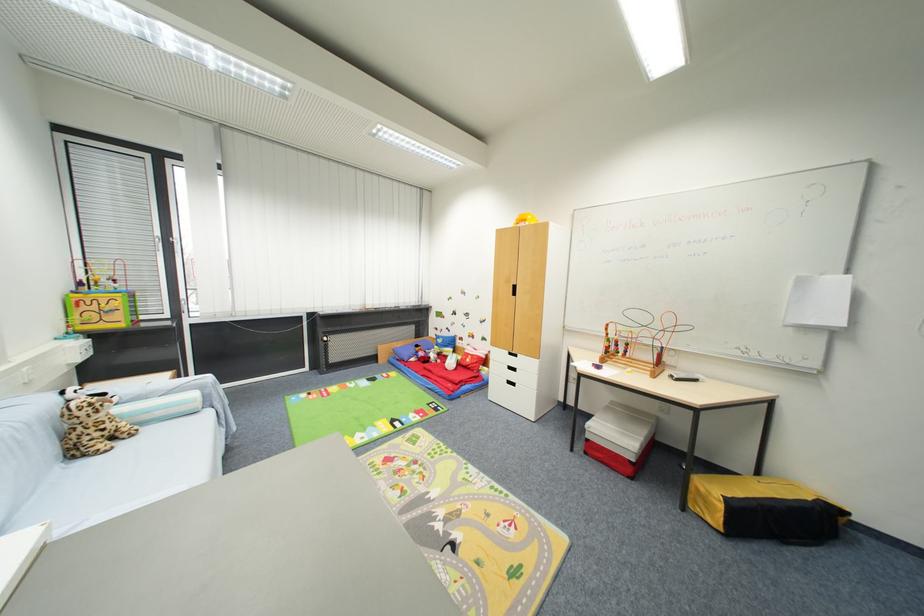
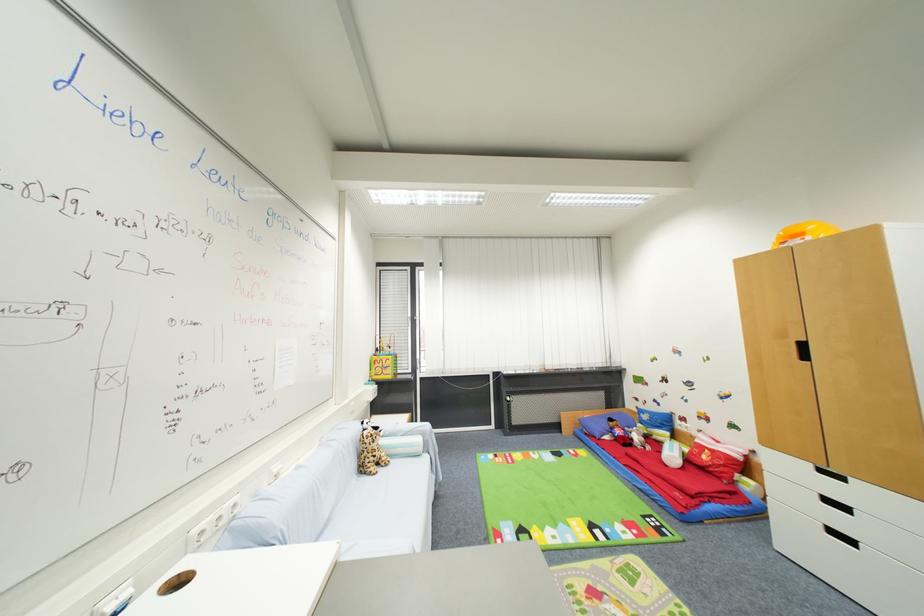
Where in the second image is the point corresponding to (x=513, y=354) from the first image?

(816, 467)